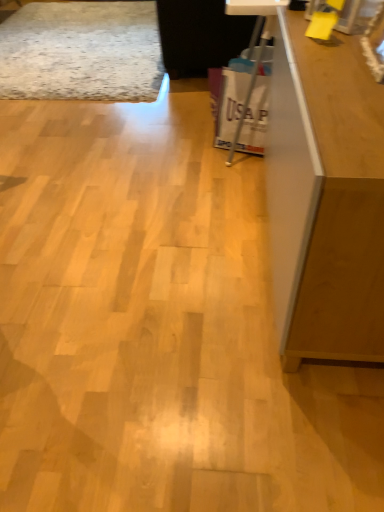
Where is `empty space that is in between wooden counter top at upper right and matte brown cabinet at right`? The height and width of the screenshot is (512, 384). empty space that is in between wooden counter top at upper right and matte brown cabinet at right is located at coordinates (249, 217).